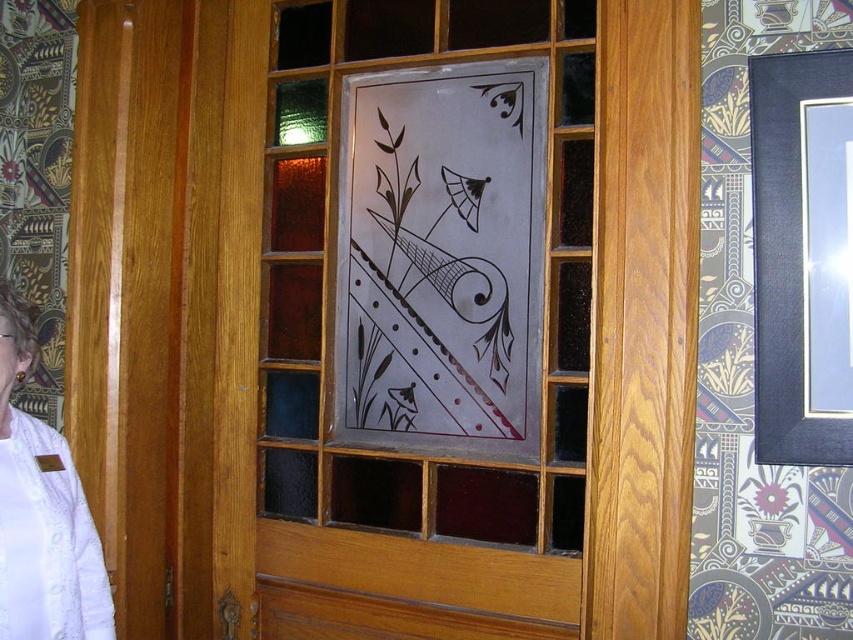
Who is more forward, (664,337) or (497,195)?

Point (664,337)

Is point (436, 417) positioned after point (534, 209)?

Yes, it is behind point (534, 209).

Is point (294, 216) farther from camera compared to point (439, 273)?

Yes, it is.

This screenshot has height=640, width=853. I want to click on transparent glass door at center, so click(457, 316).

This screenshot has height=640, width=853. What do you see at coordinates (457, 316) in the screenshot?
I see `transparent glass door at center` at bounding box center [457, 316].

Between transparent glass door at center and white fabric at left, which one has less height?

Standing shorter between the two is white fabric at left.

Identify the location of transparent glass door at center. click(457, 316).

Does transparent glass artwork at center appear under white fabric at left?

No, transparent glass artwork at center is not below white fabric at left.

Who is more forward, (409, 428) or (79, 616)?

Point (79, 616)

Does point (439, 234) lie in front of point (68, 600)?

No.

At what (x,y) coordinates should I click in order to perform the action: click on transparent glass artwork at center. Please return your answer as a coordinate pair (x, y). This screenshot has width=853, height=640. Looking at the image, I should click on (439, 253).